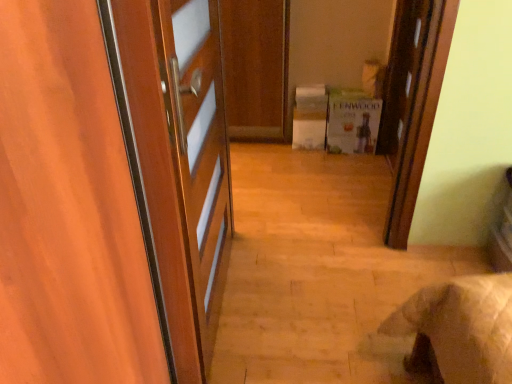
Measure the distance between point (x=341, y=111) and camera.

Point (x=341, y=111) and camera are 2.96 meters apart.

Find the location of a particular element. Image resolution: width=512 pixels, height=384 pixels. wooden door at upper right, which is the first door from right to left is located at coordinates (421, 126).

What do you see at coordinates (421, 126) in the screenshot? Image resolution: width=512 pixels, height=384 pixels. I see `wooden door at upper right, which is the first door from right to left` at bounding box center [421, 126].

I want to click on green cardboard box at center, so click(352, 122).

Which is closer to the camera, (413, 159) or (47, 288)?

Point (413, 159) is farther from the camera than point (47, 288).

Looking at this image, is wooden door at upper right, acting as the first door starting from the top, next to wooden door at left, which is the 2th door from right to left?

No, wooden door at upper right, acting as the first door starting from the top, is not making contact with wooden door at left, which is the 2th door from right to left.

The height and width of the screenshot is (384, 512). Find the location of `door on the left side of wooden door at upper right, acting as the first door starting from the top`. door on the left side of wooden door at upper right, acting as the first door starting from the top is located at coordinates (68, 209).

How different are the orientations of wooden door at upper right, marked as the 2th door in a front-to-back arrangement, and wooden door at left, placed as the second door when sorted from top to bottom, in degrees?

179 degrees.

Which of these two, green cardboard box at center or wooden door at left, which is counted as the first door, starting from the bottom, is wider?

Wider between the two is green cardboard box at center.

Does point (345, 105) appear closer or farther from the camera than point (38, 153)?

Point (345, 105) appears to be farther away from the viewer than point (38, 153).

Based on the photo, is green cardboard box at center turned away from wooden door at left, which is the 2th door from right to left?

No, green cardboard box at center is not facing away from wooden door at left, which is the 2th door from right to left.

Considering the sizes of objects green cardboard box at center and wooden door at upper right, which appears as the second door when ordered from the bottom, in the image provided, who is bigger, green cardboard box at center or wooden door at upper right, which appears as the second door when ordered from the bottom,?

wooden door at upper right, which appears as the second door when ordered from the bottom.

Is wooden door at upper right, acting as the first door starting from the top, located within green cardboard box at center?

No, green cardboard box at center does not contain wooden door at upper right, acting as the first door starting from the top.

Can you see green cardboard box at center touching wooden door at upper right, which appears as the second door when ordered from the bottom?

No, green cardboard box at center is not beside wooden door at upper right, which appears as the second door when ordered from the bottom.

Is wooden door at upper right, acting as the first door starting from the top, not within green cardboard box at center?

That's correct, wooden door at upper right, acting as the first door starting from the top, is outside of green cardboard box at center.

Considering the relative positions of wooden door at upper right, acting as the first door starting from the top, and green cardboard box at center in the image provided, is wooden door at upper right, acting as the first door starting from the top, to the right of green cardboard box at center from the viewer's perspective?

Yes.

Between wooden door at upper right, acting as the first door starting from the top, and green cardboard box at center, which one is positioned in front?

wooden door at upper right, acting as the first door starting from the top, is more forward.

Is wooden door at upper right, acting as the first door starting from the top, oriented towards green cardboard box at center?

Yes, wooden door at upper right, acting as the first door starting from the top, faces towards green cardboard box at center.

Is wooden door at left, placed as the second door when sorted from top to bottom, not close to wooden door at upper right, which appears as the second door when ordered from the bottom?

Yes, wooden door at left, placed as the second door when sorted from top to bottom, and wooden door at upper right, which appears as the second door when ordered from the bottom, are located far from each other.

From the image's perspective, which is above, wooden door at left, the second door viewed from the back, or wooden door at upper right, which ranks as the 2th door in left-to-right order?

From the image's view, wooden door at upper right, which ranks as the 2th door in left-to-right order, is above.

Image resolution: width=512 pixels, height=384 pixels. In order to click on door above the wooden door at upper right, marked as the first door in a back-to-front arrangement (from a real-world perspective) in this screenshot , I will do `click(68, 209)`.

From their relative heights in the image, would you say wooden door at left, which is the 2th door from right to left, is taller or shorter than wooden door at upper right, marked as the 2th door in a front-to-back arrangement?

Clearly, wooden door at left, which is the 2th door from right to left, is taller compared to wooden door at upper right, marked as the 2th door in a front-to-back arrangement.

In terms of height, does wooden door at left, placed as the second door when sorted from top to bottom, look taller or shorter compared to green cardboard box at center?

In the image, wooden door at left, placed as the second door when sorted from top to bottom, appears to be taller than green cardboard box at center.

From the image's perspective, is wooden door at left, which is the 2th door from right to left, below green cardboard box at center?

Correct, wooden door at left, which is the 2th door from right to left, appears lower than green cardboard box at center in the image.

Does point (136, 273) lie behind point (328, 129)?

No, (136, 273) is in front of (328, 129).

Which of these two, wooden door at left, which is the first door from left to right, or green cardboard box at center, is bigger?

green cardboard box at center.

I want to click on door on the left of wooden door at upper right, which is the first door from right to left, so click(x=68, y=209).

Where is `cabinetry below the wooden door at left, placed as the second door when sorted from top to bottom (from a real-world perspective)`? cabinetry below the wooden door at left, placed as the second door when sorted from top to bottom (from a real-world perspective) is located at coordinates (352, 122).

When comparing their distances from wooden door at upper right, acting as the first door starting from the top, does wooden door at left, positioned as the 1th door in front-to-back order, or green cardboard box at center seem closer?

Among the two, green cardboard box at center is located nearer to wooden door at upper right, acting as the first door starting from the top.

Based on their spatial positions, is wooden door at upper right, which is the first door from right to left, or green cardboard box at center closer to wooden door at left, which is the first door from left to right?

Among the two, wooden door at upper right, which is the first door from right to left, is located nearer to wooden door at left, which is the first door from left to right.

Considering their positions, is wooden door at upper right, marked as the 2th door in a front-to-back arrangement, positioned closer to green cardboard box at center than wooden door at left, placed as the second door when sorted from top to bottom?

The object closer to green cardboard box at center is wooden door at upper right, marked as the 2th door in a front-to-back arrangement.

Based on their spatial positions, is green cardboard box at center or wooden door at left, the second door viewed from the back, closer to wooden door at upper right, which ranks as the 2th door in left-to-right order?

The object closer to wooden door at upper right, which ranks as the 2th door in left-to-right order, is green cardboard box at center.

Consider the image. From the image, which object appears to be farther from wooden door at left, which is counted as the first door, starting from the bottom, green cardboard box at center or wooden door at upper right, which appears as the second door when ordered from the bottom?

The object further to wooden door at left, which is counted as the first door, starting from the bottom, is green cardboard box at center.

Based on their spatial positions, is wooden door at left, placed as the second door when sorted from top to bottom, or wooden door at upper right, which is the first door from right to left, further from green cardboard box at center?

wooden door at left, placed as the second door when sorted from top to bottom, lies further to green cardboard box at center than the other object.

Identify the location of door located between wooden door at left, placed as the second door when sorted from top to bottom, and green cardboard box at center in the depth direction. The width and height of the screenshot is (512, 384). (421, 126).